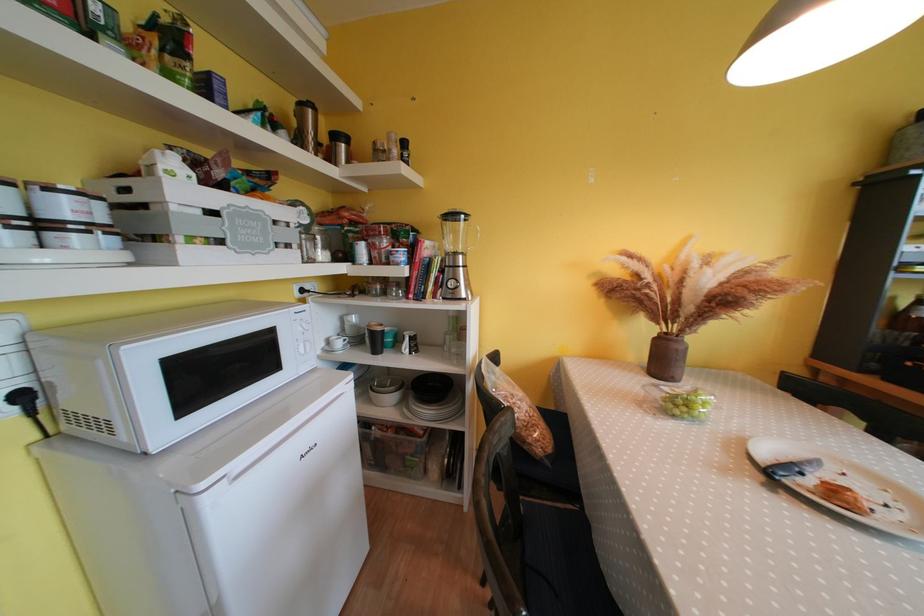
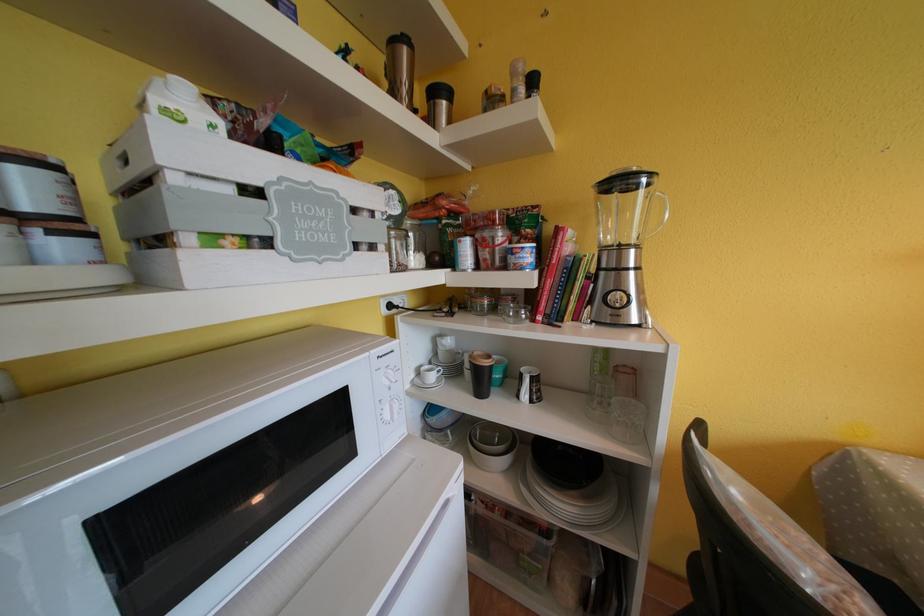
In the second image, find the point that corresponds to point 467,260 in the first image.

(638, 254)